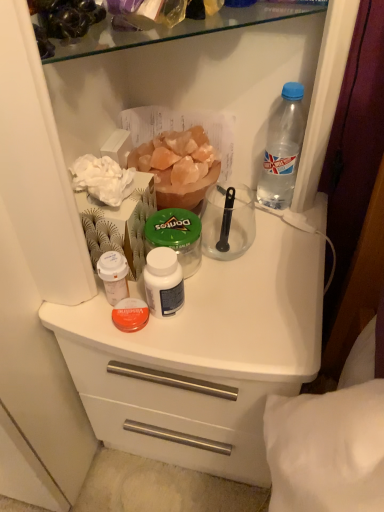
Identify the location of vacant space to the right of white matte jar at center. The height and width of the screenshot is (512, 384). (251, 302).